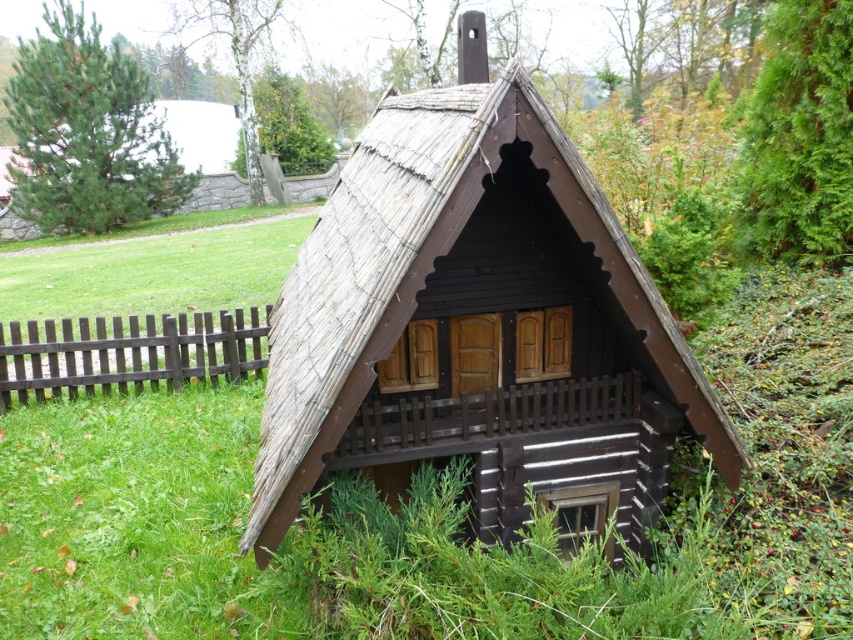
You are standing on the green grass at center and want to reach the matte black cabin at center. Which direction should you move to get closer to the cabin?

The matte black cabin at center is above green grass at center, so you should move upward to get closer to the cabin.

You are planning to place a 3m wide garden bed in the area. Given the green grass at center and the brown wooden fence at lower left, which area can accommodate the garden bed based on their widths?

The green grass at center has a greater width than the brown wooden fence at lower left, so the garden bed can be placed on the green grass at center since it is wider.